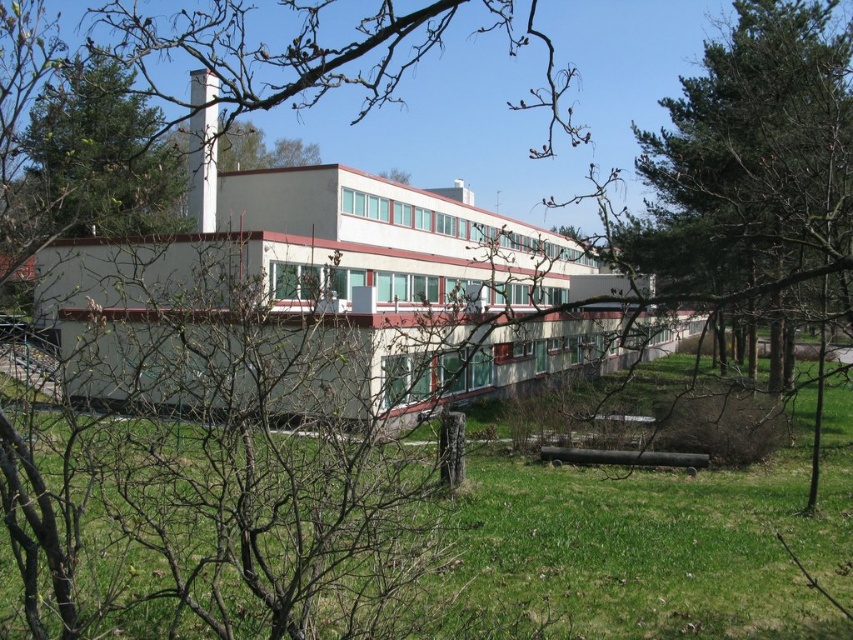
You are a drone operator trying to capture a photo of the green leafy tree at upper left and the white smooth chimney at upper center. Based on their sizes in the image, which object would appear smaller in the photo?

The green leafy tree at upper left would appear smaller in the photo because it has a smaller size compared to the white smooth chimney at upper center.

You are standing in front of the modern building and want to take a photo of the white smooth chimney at upper center without the green leafy tree at upper left blocking it. How should you adjust your position?

Move to the right side of the green leafy tree at upper left so that the tree is no longer blocking the view of the white smooth chimney at upper center.

You are an architect analyzing the building. From your viewpoint, which object, the green leafy tree at upper left or the white smooth chimney at upper center, is shorter?

The green leafy tree at upper left is shorter than the white smooth chimney at upper center.